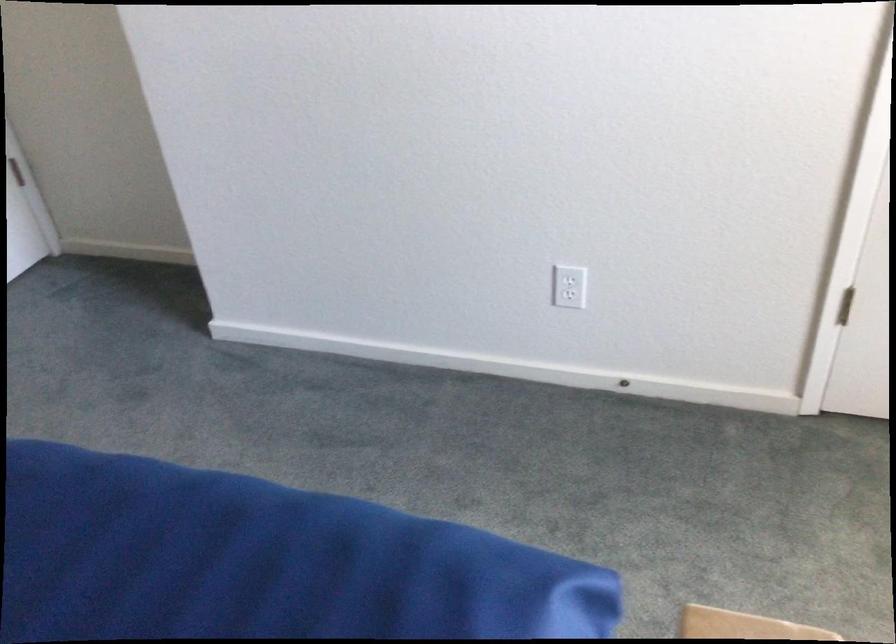
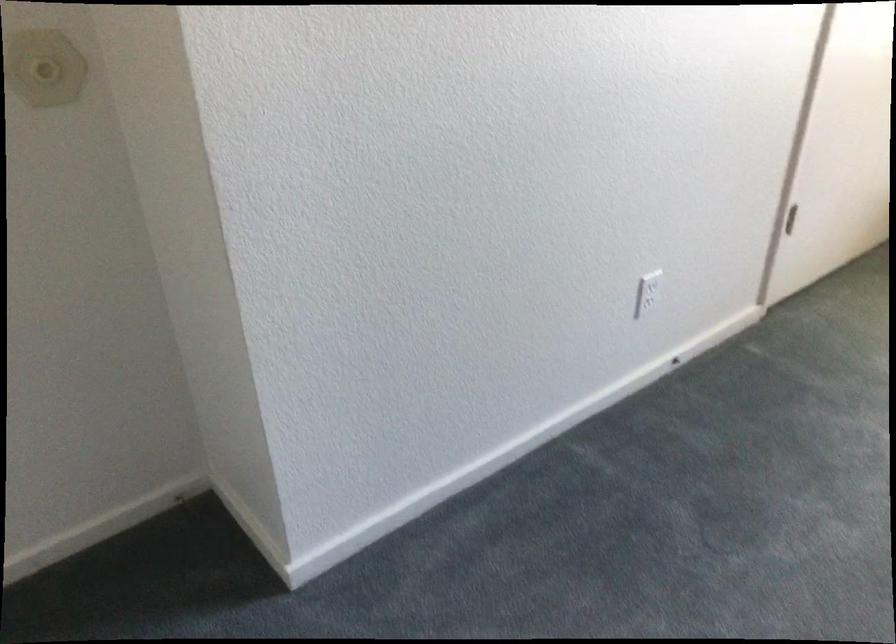
The point at (582, 281) is marked in the first image. Where is the corresponding point in the second image?

(650, 285)